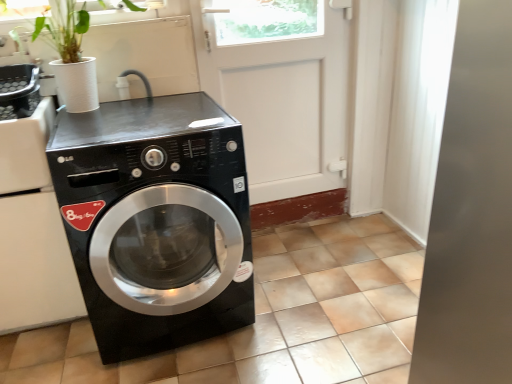
The width and height of the screenshot is (512, 384). I want to click on black glossy washing machine at left, so click(x=154, y=219).

Describe the element at coordinates (154, 219) in the screenshot. This screenshot has height=384, width=512. I see `black glossy washing machine at left` at that location.

The height and width of the screenshot is (384, 512). What are the coordinates of `black glossy washing machine at left` in the screenshot? It's located at (154, 219).